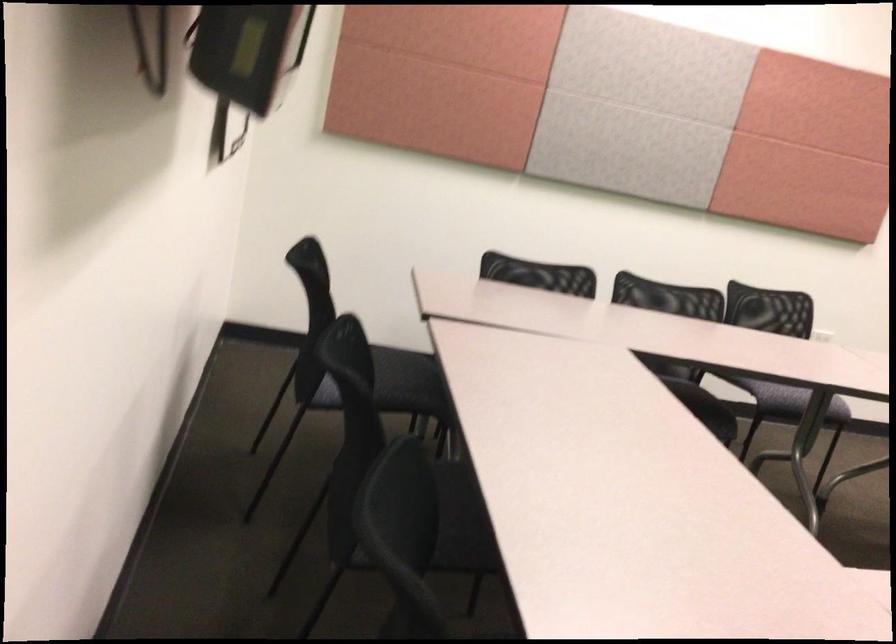
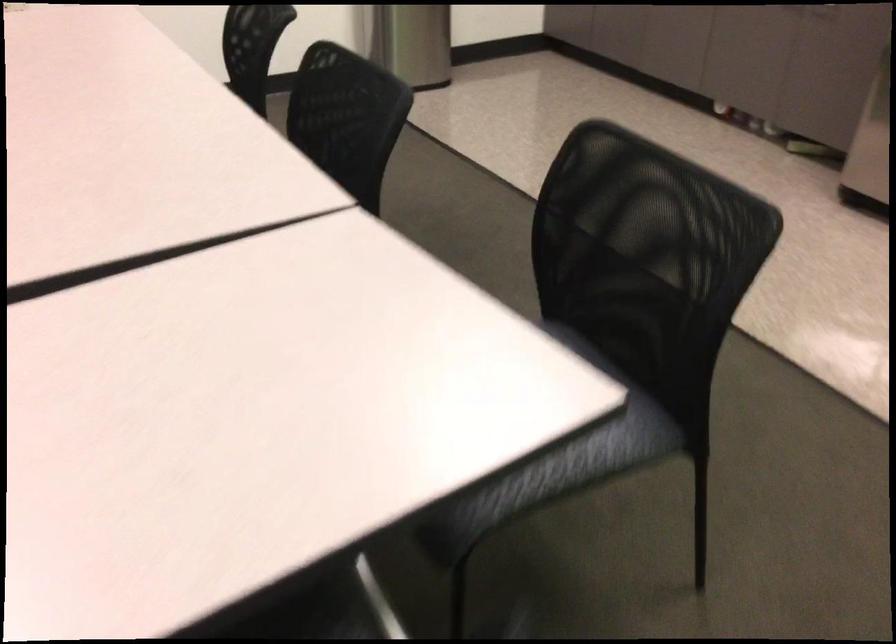
Question: The images are taken continuously from a first-person perspective. In which direction are you moving?

Choices:
 (A) Left
 (B) Right
 (C) Forward
 (D) Backward

Answer: (D)